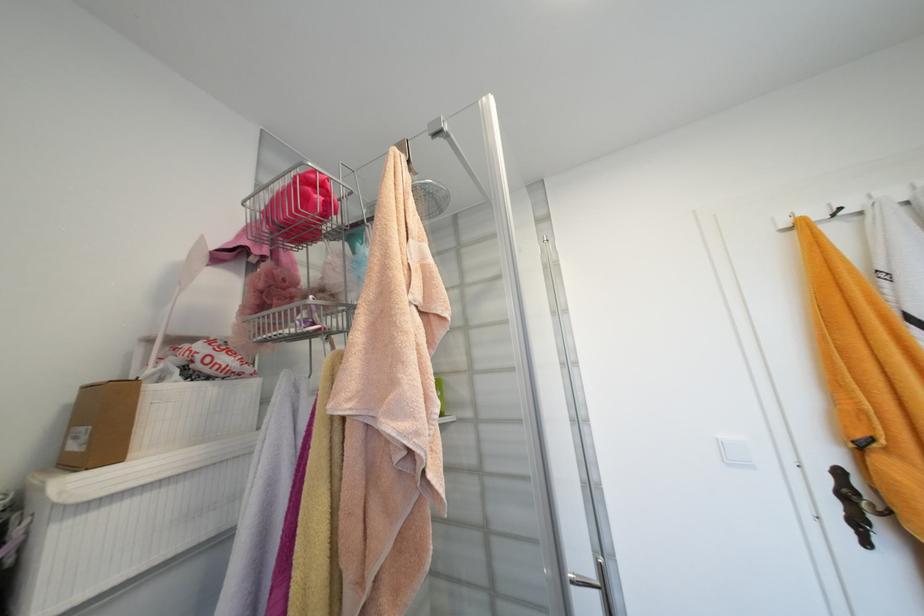
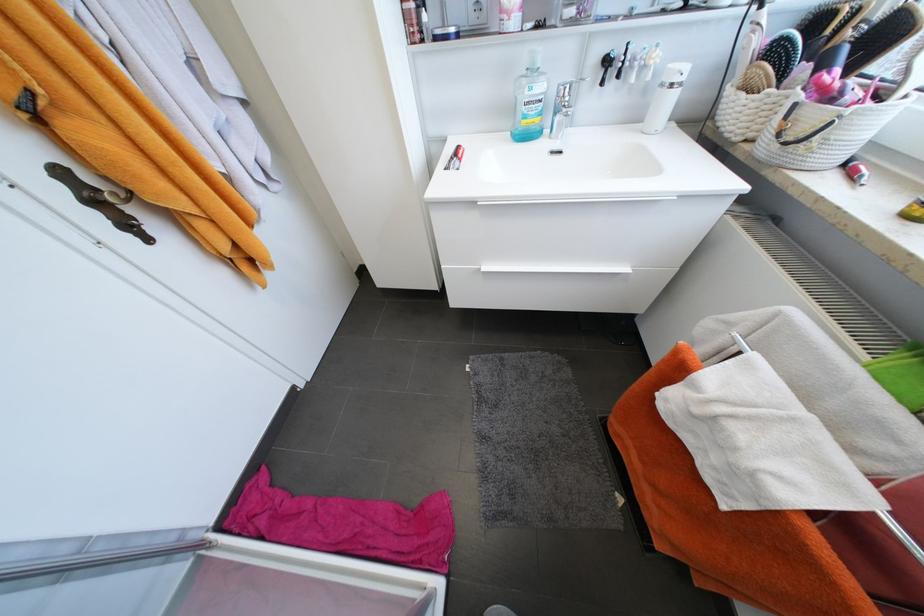
Locate, in the second image, the point that corresponds to pixel 862 524 in the first image.

(132, 225)